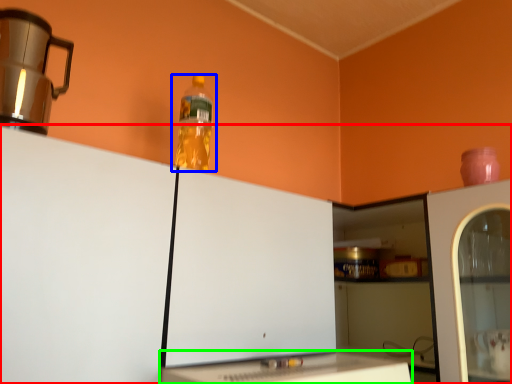
Question: Considering the real-world distances, which object is closest to cabinetry (highlighted by a red box)? bottle (highlighted by a blue box) or table (highlighted by a green box).

Choices:
 (A) bottle
 (B) table

Answer: (B)